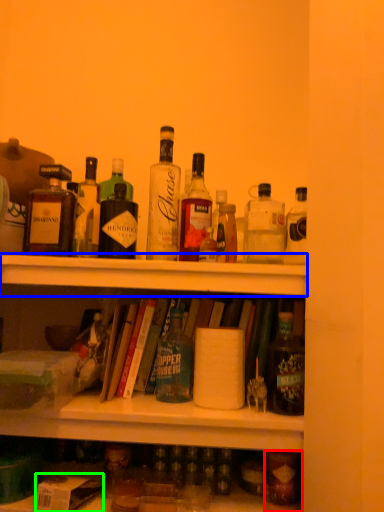
Question: Based on their relative distances, which object is nearer to bottle (highlighted by a red box)? Choose from shelf (highlighted by a blue box) and box (highlighted by a green box).

Choices:
 (A) shelf
 (B) box

Answer: (B)